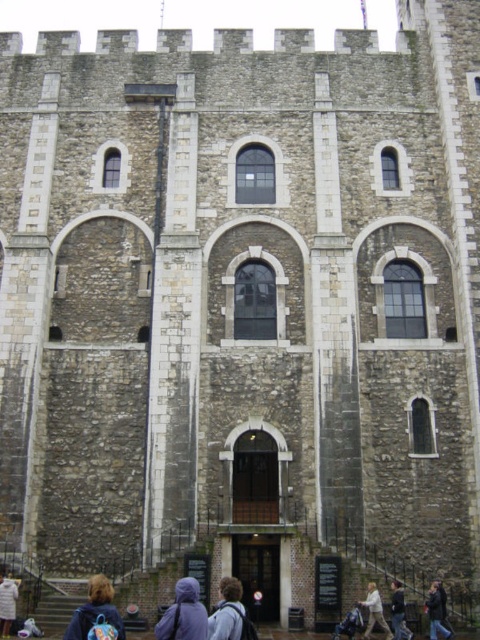
Question: Based on their relative distances, which object is nearer to the denim jacket at lower left?

Choices:
 (A) light brown wool coat at lower left
 (B) dark gray jacket at lower center
 (C) dark gray hoodie at lower center
 (D) light brown hair at lower center

Answer: (A)

Question: Can you confirm if purple fabric at lower center is positioned above dark gray hoodie at lower center?

Choices:
 (A) yes
 (B) no

Answer: (A)

Question: Does purple fabric at lower center have a smaller size compared to light brown hair at lower center?

Choices:
 (A) no
 (B) yes

Answer: (A)

Question: Considering the real-world distances, which object is farthest from the dark gray jacket at lower center?

Choices:
 (A) light brown wool coat at lower left
 (B) light blue fabric jacket at center
 (C) purple fabric at lower center

Answer: (A)

Question: In this image, where is dark gray jacket at lower center located relative to light brown hair at lower center?

Choices:
 (A) below
 (B) above

Answer: (A)

Question: Which point is closer to the camera?

Choices:
 (A) light brown wool coat at lower left
 (B) light blue fabric jacket at center
 (C) denim jacket at lower left

Answer: (C)